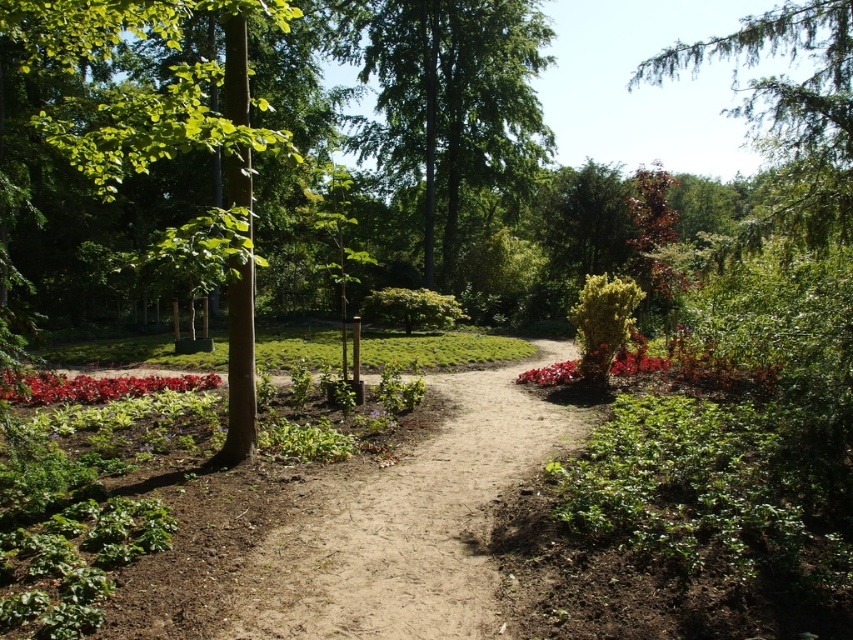
Can you confirm if green textured tree at upper right is shorter than red matte flower at center-right?

No.

Where is `green textured tree at upper right`? This screenshot has height=640, width=853. green textured tree at upper right is located at coordinates (790, 115).

In order to click on green textured tree at upper right in this screenshot , I will do tap(790, 115).

Is dirt path at center above green leafy tree at center?

Actually, dirt path at center is below green leafy tree at center.

Does dirt path at center have a larger size compared to green leafy tree at center?

No.

Identify the location of dirt path at center. The width and height of the screenshot is (853, 640). (409, 524).

Is green leafy tree at center taller than green leafy bush at center-right?

Yes, green leafy tree at center is taller than green leafy bush at center-right.

Where is `green leafy tree at center`? green leafy tree at center is located at coordinates (448, 99).

Describe the element at coordinates (448, 99) in the screenshot. The width and height of the screenshot is (853, 640). I see `green leafy tree at center` at that location.

You are a GUI agent. You are given a task and a screenshot of the screen. Output one action in this format:
    pyautogui.click(x=<x>, y=<y>)
    Task: Click on the green leafy tree at center
    The height and width of the screenshot is (640, 853).
    Given the screenshot: What is the action you would take?
    pyautogui.click(x=448, y=99)